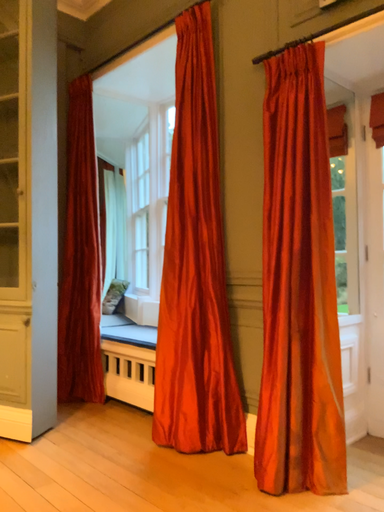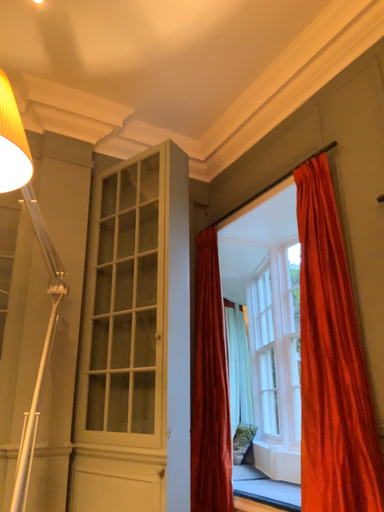
Question: How did the camera likely rotate when shooting the video?

Choices:
 (A) rotated downward
 (B) rotated upward

Answer: (B)